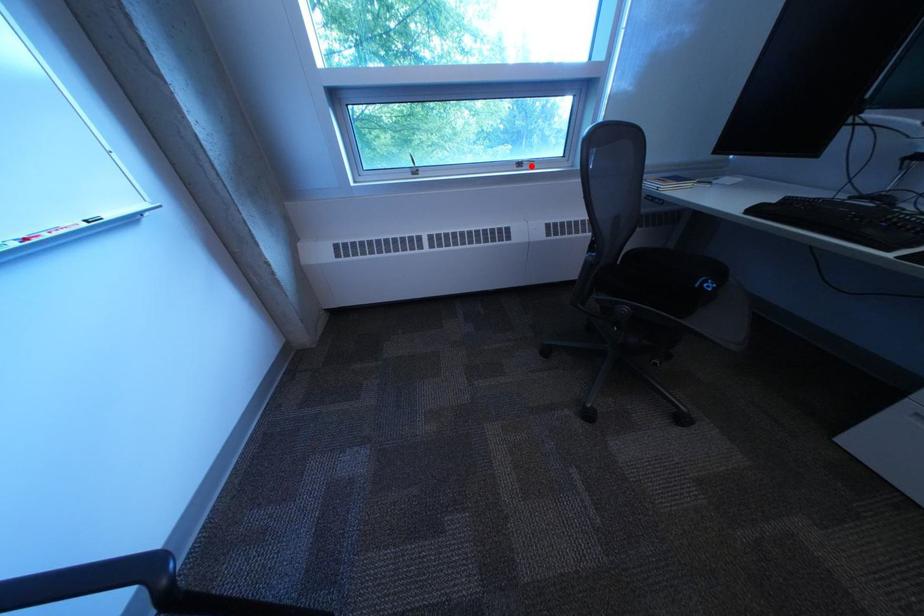
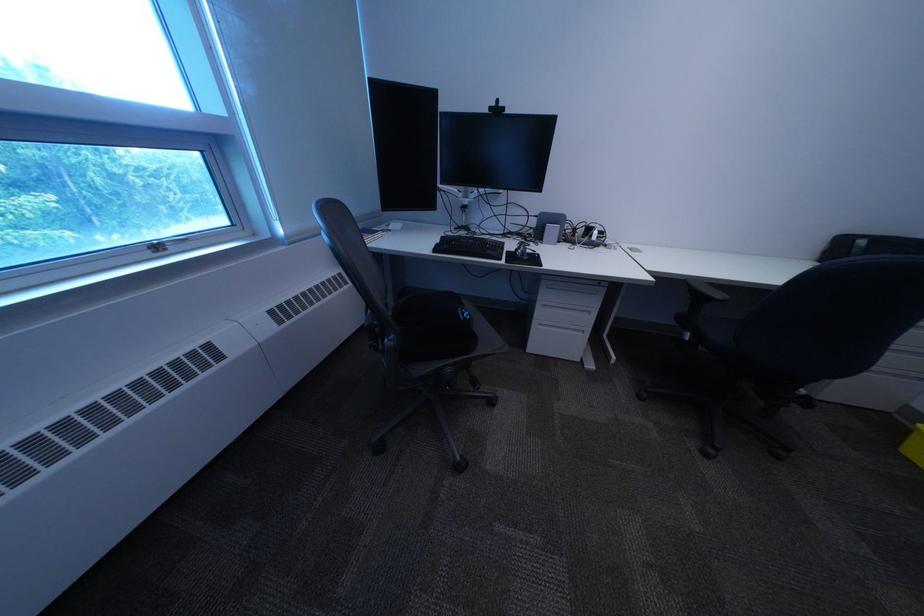
Locate, in the second image, the point that corresponds to the highlighted location in the first image.

(164, 251)